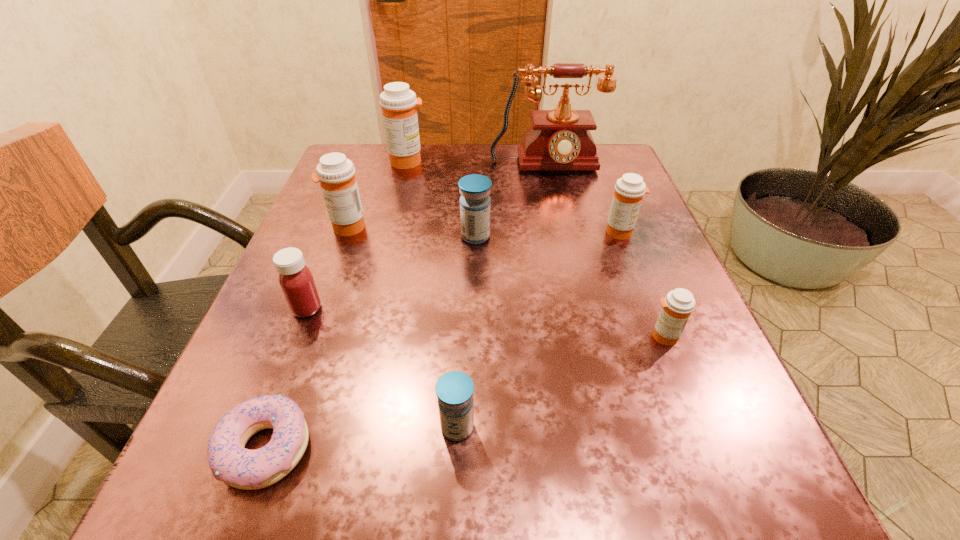
Locate an element on the screen. This screenshot has height=540, width=960. the nearest orange medicine is located at coordinates (677, 306).

You are a GUI agent. You are given a task and a screenshot of the screen. Output one action in this format:
    pyautogui.click(x=<x>, y=<y>)
    Task: Click on the smaller blue medicine
    The width and height of the screenshot is (960, 540).
    Given the screenshot: What is the action you would take?
    pyautogui.click(x=454, y=390)

I want to click on the nearer blue medicine, so click(454, 390).

You are a GUI agent. You are given a task and a screenshot of the screen. Output one action in this format:
    pyautogui.click(x=<x>, y=<y>)
    Task: Click on the shortest object
    Image resolution: width=960 pixels, height=540 pixels.
    Given the screenshot: What is the action you would take?
    pyautogui.click(x=229, y=460)

Where is `doughnut`? This screenshot has width=960, height=540. doughnut is located at coordinates (229, 460).

Find the location of a particular element. vacant space located 0.120m on the dial of the telephone is located at coordinates (556, 212).

Find the location of a particular element. The image size is (960, 540). free location located on the front of the third orange medicine from right to left is located at coordinates (401, 188).

Locate an element on the screen. Image resolution: width=960 pixels, height=540 pixels. free space located on the back of the leftmost orange medicine is located at coordinates (x=364, y=181).

Where is `vacant space located 0.250m on the back of the farther blue medicine`? Image resolution: width=960 pixels, height=540 pixels. vacant space located 0.250m on the back of the farther blue medicine is located at coordinates (476, 165).

This screenshot has height=540, width=960. I want to click on vacant space located on the front of the second smallest orange medicine, so click(x=661, y=338).